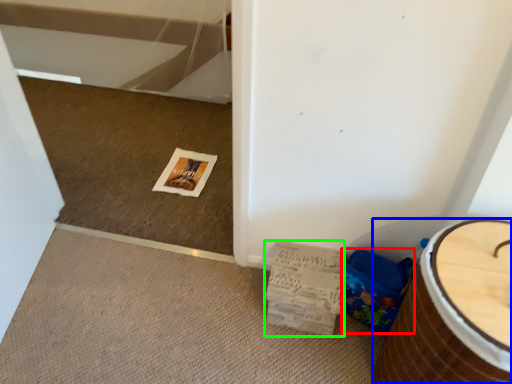
Question: Which is farther away from potty (highlighted by a red box)? furniture (highlighted by a blue box) or magazine (highlighted by a green box)?

Choices:
 (A) furniture
 (B) magazine

Answer: (A)